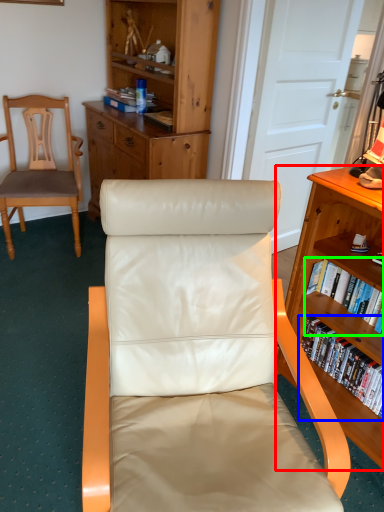
Question: Considering the real-world distances, which object is farthest from shelf (highlighted by a red box)? book (highlighted by a blue box) or book (highlighted by a green box)?

Choices:
 (A) book
 (B) book

Answer: (A)